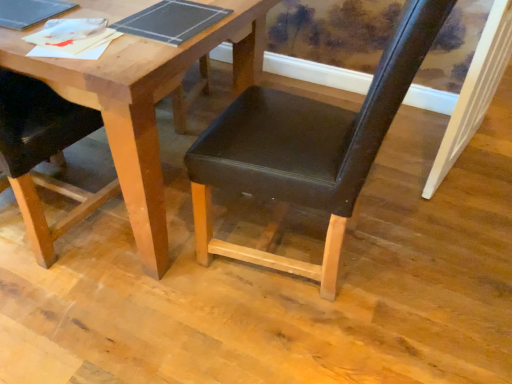
What is the approximate width of white painted wood door frame at right?

It is 5.76 inches.

Identify the location of matte black chair at left, arranged as the 1th chair when viewed from the left. Image resolution: width=512 pixels, height=384 pixels. (42, 155).

From the image's perspective, who appears lower, matte black chair at left, the second chair from the right, or white painted wood door frame at right?

matte black chair at left, the second chair from the right, is shown below in the image.

Does matte black chair at left, the second chair from the right, appear on the right side of white painted wood door frame at right?

In fact, matte black chair at left, the second chair from the right, is to the left of white painted wood door frame at right.

Is matte black chair at left, the second chair from the right, in front of or behind white painted wood door frame at right in the image?

matte black chair at left, the second chair from the right, is in front of white painted wood door frame at right.

Is matte black chair at left, the second chair from the right, outside of matte black chair at center, the first chair positioned from the right?

Yes.

The height and width of the screenshot is (384, 512). What are the coordinates of `chair that is in front of the matte black chair at left, the second chair from the right` in the screenshot? It's located at (306, 148).

How different are the orientations of matte black chair at left, the second chair from the right, and matte black chair at center, placed as the second chair when sorted from left to right, in degrees?

93.1 degrees separate the facing orientations of matte black chair at left, the second chair from the right, and matte black chair at center, placed as the second chair when sorted from left to right.

From a real-world perspective, is matte black chair at left, arranged as the 1th chair when viewed from the left, positioned under matte black chair at center, placed as the second chair when sorted from left to right, based on gravity?

Yes.

From the image's perspective, is white painted wood door frame at right above or below matte black chair at left, the second chair from the right?

Based on their image positions, white painted wood door frame at right is located above matte black chair at left, the second chair from the right.

Is white painted wood door frame at right looking in the opposite direction of matte black chair at left, arranged as the 1th chair when viewed from the left?

That's not correct — white painted wood door frame at right is not looking away from matte black chair at left, arranged as the 1th chair when viewed from the left.

Is matte black chair at left, the second chair from the right, a part of white painted wood door frame at right?

That's incorrect, matte black chair at left, the second chair from the right, is not inside white painted wood door frame at right.

Which object is positioned more to the right, matte black chair at center, placed as the second chair when sorted from left to right, or white painted wood door frame at right?

From the viewer's perspective, white painted wood door frame at right appears more on the right side.

Which is in front, point (297, 154) or point (456, 116)?

Point (297, 154)

Considering the relative sizes of matte black chair at center, placed as the second chair when sorted from left to right, and white painted wood door frame at right in the image provided, is matte black chair at center, placed as the second chair when sorted from left to right, shorter than white painted wood door frame at right?

No.

Which chair is the 1st one when counting from the left side of the white painted wood door frame at right? Please provide its 2D coordinates.

[(306, 148)]

From the picture: Which point is more forward, (79, 64) or (326, 162)?

The point (79, 64) is in front.

Considering the relative sizes of wooden table at center and matte black chair at center, the first chair positioned from the right, in the image provided, is wooden table at center smaller than matte black chair at center, the first chair positioned from the right,?

No, wooden table at center is not smaller than matte black chair at center, the first chair positioned from the right.

Is wooden table at center positioned far away from matte black chair at center, the first chair positioned from the right?

No, wooden table at center is not far from matte black chair at center, the first chair positioned from the right.

Is matte black chair at center, the first chair positioned from the right, with matte black chair at left, arranged as the 1th chair when viewed from the left?

No, matte black chair at center, the first chair positioned from the right, is not making contact with matte black chair at left, arranged as the 1th chair when viewed from the left.

From the picture: Looking at the image, does matte black chair at center, the first chair positioned from the right, seem bigger or smaller compared to matte black chair at left, arranged as the 1th chair when viewed from the left?

matte black chair at center, the first chair positioned from the right, is bigger than matte black chair at left, arranged as the 1th chair when viewed from the left.

Which is in front, point (297, 162) or point (36, 131)?

Point (297, 162)

Which is behind, matte black chair at center, placed as the second chair when sorted from left to right, or matte black chair at left, the second chair from the right?

matte black chair at left, the second chair from the right, is further from the camera.

Is wooden table at center touching white painted wood door frame at right?

wooden table at center and white painted wood door frame at right are not in contact.

Can we say wooden table at center lies outside white painted wood door frame at right?

Yes, wooden table at center is outside of white painted wood door frame at right.

Which is closer to the camera, (x=251, y=60) or (x=434, y=191)?

Point (x=251, y=60).

From a real-world perspective, between wooden table at center and white painted wood door frame at right, who is vertically lower?

From a 3D spatial view, wooden table at center is below.

Where is `the 1st chair directly above the white painted wood door frame at right (from a real-world perspective)`? This screenshot has height=384, width=512. the 1st chair directly above the white painted wood door frame at right (from a real-world perspective) is located at coordinates point(42,155).

Identify the location of chair below the matte black chair at left, arranged as the 1th chair when viewed from the left (from the image's perspective). (306, 148).

Considering their positions, is matte black chair at center, placed as the second chair when sorted from left to right, positioned further to wooden table at center than white painted wood door frame at right?

white painted wood door frame at right lies further to wooden table at center than the other object.

Estimate the real-world distances between objects in this image. Which object is further from matte black chair at center, placed as the second chair when sorted from left to right, wooden table at center or white painted wood door frame at right?

white painted wood door frame at right is further to matte black chair at center, placed as the second chair when sorted from left to right.

From the picture: From the image, which object appears to be farther from wooden table at center, matte black chair at left, the second chair from the right, or white painted wood door frame at right?

white painted wood door frame at right.

Estimate the real-world distances between objects in this image. Which object is further from matte black chair at center, the first chair positioned from the right, matte black chair at left, the second chair from the right, or white painted wood door frame at right?

white painted wood door frame at right is further to matte black chair at center, the first chair positioned from the right.

Estimate the real-world distances between objects in this image. Which object is further from white painted wood door frame at right, matte black chair at center, placed as the second chair when sorted from left to right, or wooden table at center?

wooden table at center lies further to white painted wood door frame at right than the other object.

Based on their spatial positions, is matte black chair at left, the second chair from the right, or matte black chair at center, placed as the second chair when sorted from left to right, closer to white painted wood door frame at right?

Among the two, matte black chair at center, placed as the second chair when sorted from left to right, is located nearer to white painted wood door frame at right.

When comparing their distances from matte black chair at center, placed as the second chair when sorted from left to right, does matte black chair at left, the second chair from the right, or wooden table at center seem further?

matte black chair at left, the second chair from the right.

Looking at this image, which object lies nearer to the anchor point white painted wood door frame at right, wooden table at center or matte black chair at left, the second chair from the right?

wooden table at center.

This screenshot has height=384, width=512. What are the coordinates of `chair between wooden table at center and matte black chair at center, placed as the second chair when sorted from left to right, from left to right` in the screenshot? It's located at (42, 155).

Where is `chair situated between matte black chair at left, the second chair from the right, and white painted wood door frame at right from left to right`? The image size is (512, 384). chair situated between matte black chair at left, the second chair from the right, and white painted wood door frame at right from left to right is located at coordinates point(306,148).